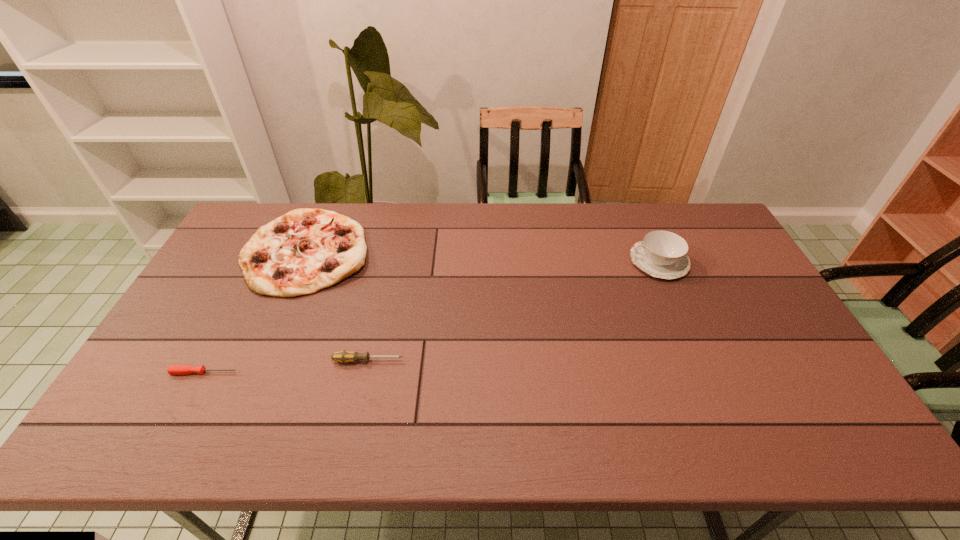
Where is `the rightmost object`? This screenshot has height=540, width=960. the rightmost object is located at coordinates (662, 254).

In order to click on the tallest object in this screenshot , I will do `click(662, 254)`.

Identify the location of the third shortest object. The width and height of the screenshot is (960, 540). (304, 251).

Where is `the taller screwdriver`? the taller screwdriver is located at coordinates (345, 356).

Find the location of a particular element. The image size is (960, 540). the third farthest object is located at coordinates (345, 356).

You are a GUI agent. You are given a task and a screenshot of the screen. Output one action in this format:
    pyautogui.click(x=<x>, y=<y>)
    Task: Click on the left screwdriver
    
    Given the screenshot: What is the action you would take?
    pyautogui.click(x=173, y=369)

Find the location of a particular element. This screenshot has width=960, height=540. the shorter screwdriver is located at coordinates (173, 369).

You are a GUI agent. You are given a task and a screenshot of the screen. Output one action in this format:
    pyautogui.click(x=<x>, y=<y>)
    Task: Click on the vacant position located 0.360m on the handle side of the chinaware
    Image resolution: width=960 pixels, height=540 pixels.
    Given the screenshot: What is the action you would take?
    pyautogui.click(x=519, y=261)

This screenshot has height=540, width=960. I want to click on free space located on the handle side of the chinaware, so click(522, 261).

Locate an element on the screen. The width and height of the screenshot is (960, 540). vacant area located on the handle side of the chinaware is located at coordinates (540, 261).